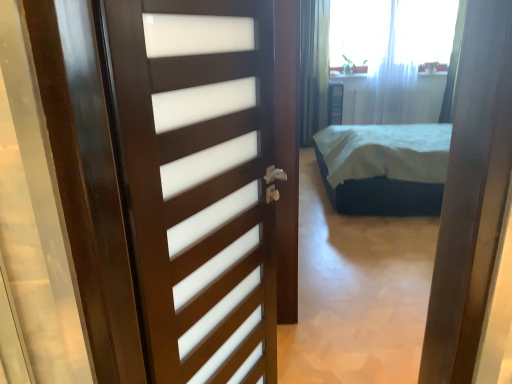
Question: Is white sheer curtain at upper center not within white sheer curtain at upper center, arranged as the first curtain when viewed from the left?

Choices:
 (A) no
 (B) yes

Answer: (B)

Question: Can you confirm if white sheer curtain at upper center is shorter than white sheer curtain at upper center, placed as the second curtain when sorted from right to left?

Choices:
 (A) no
 (B) yes

Answer: (B)

Question: Is white sheer curtain at upper center smaller than white sheer curtain at upper center, arranged as the first curtain when viewed from the left?

Choices:
 (A) no
 (B) yes

Answer: (B)

Question: Considering the relative sizes of white sheer curtain at upper center and white sheer curtain at upper center, placed as the second curtain when sorted from right to left, in the image provided, is white sheer curtain at upper center bigger than white sheer curtain at upper center, placed as the second curtain when sorted from right to left,?

Choices:
 (A) yes
 (B) no

Answer: (B)

Question: Is white sheer curtain at upper center positioned before white sheer curtain at upper center, arranged as the first curtain when viewed from the left?

Choices:
 (A) no
 (B) yes

Answer: (A)

Question: Considering the positions of point (411, 115) and point (424, 1), is point (411, 115) closer or farther from the camera than point (424, 1)?

Choices:
 (A) closer
 (B) farther

Answer: (B)

Question: Is white sheer curtain at upper center, arranged as the first curtain when viewed from the left, in front of or behind white sheer curtain at upper center in the image?

Choices:
 (A) front
 (B) behind

Answer: (A)

Question: From the image's perspective, is white sheer curtain at upper center, placed as the second curtain when sorted from right to left, positioned above or below white sheer curtain at upper center?

Choices:
 (A) above
 (B) below

Answer: (B)

Question: Considering the positions of white sheer curtain at upper center, placed as the second curtain when sorted from right to left, and white sheer curtain at upper center in the image, is white sheer curtain at upper center, placed as the second curtain when sorted from right to left, bigger or smaller than white sheer curtain at upper center?

Choices:
 (A) big
 (B) small

Answer: (A)

Question: Is white sheer curtain at upper center inside or outside of white sheer curtain at upper right, the second curtain viewed from the left?

Choices:
 (A) inside
 (B) outside

Answer: (B)

Question: Is white sheer curtain at upper center to the left or to the right of white sheer curtain at upper right, acting as the 1th curtain starting from the right, in the image?

Choices:
 (A) left
 (B) right

Answer: (A)

Question: Is white sheer curtain at upper center wider or thinner than white sheer curtain at upper right, the second curtain viewed from the left?

Choices:
 (A) wide
 (B) thin

Answer: (B)

Question: From the image's perspective, is white sheer curtain at upper center located above or below white sheer curtain at upper right, the second curtain viewed from the left?

Choices:
 (A) above
 (B) below

Answer: (A)

Question: Looking at the image, does white sheer curtain at upper center, arranged as the first curtain when viewed from the left, seem bigger or smaller compared to white sheer curtain at upper right, acting as the 1th curtain starting from the right?

Choices:
 (A) big
 (B) small

Answer: (A)

Question: Considering the relative positions of white sheer curtain at upper center, arranged as the first curtain when viewed from the left, and white sheer curtain at upper right, acting as the 1th curtain starting from the right, in the image provided, is white sheer curtain at upper center, arranged as the first curtain when viewed from the left, to the left or to the right of white sheer curtain at upper right, acting as the 1th curtain starting from the right,?

Choices:
 (A) left
 (B) right

Answer: (A)